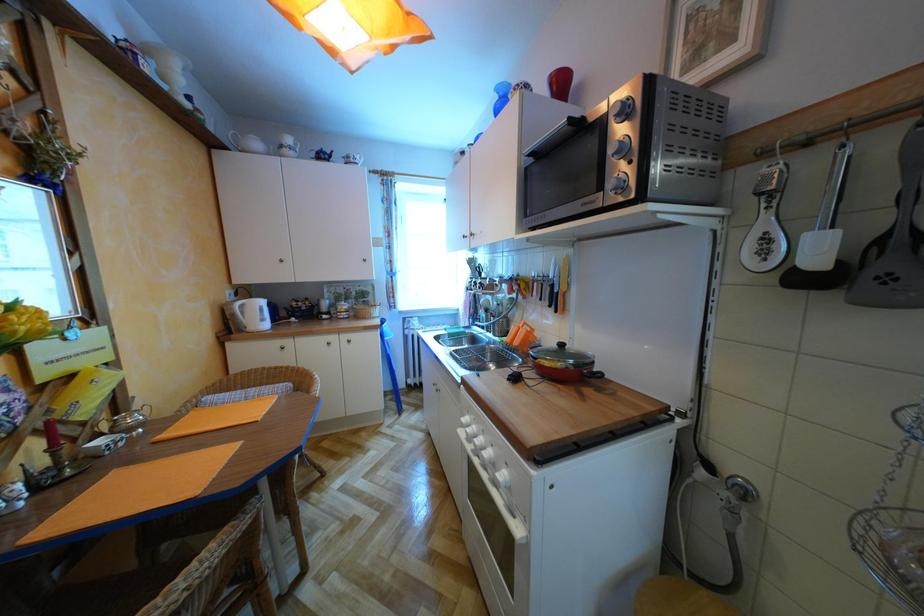
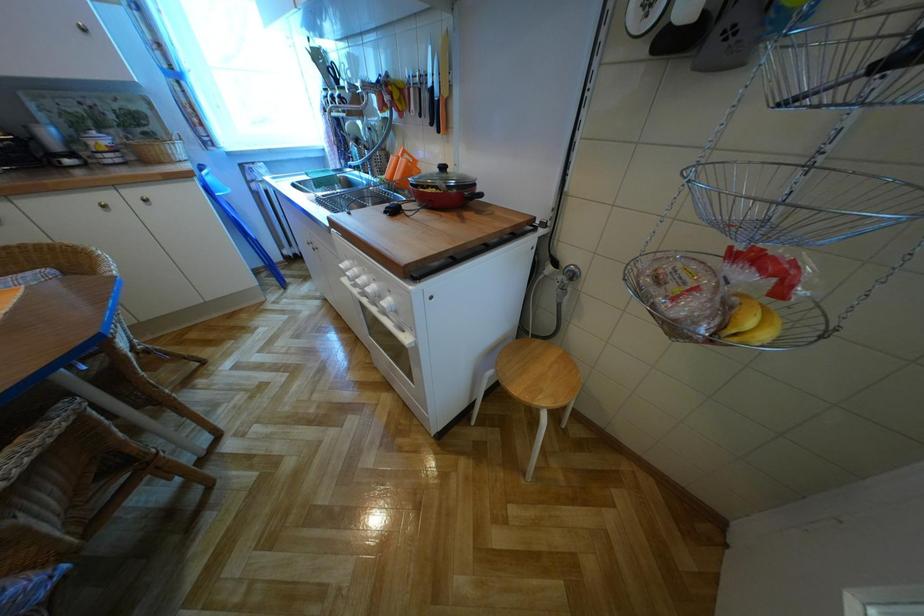
How did the camera likely rotate?

The rotation direction of the camera is right-down.